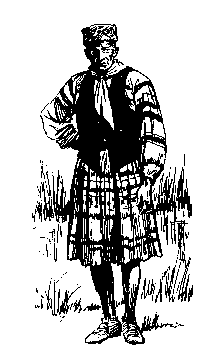
This screenshot has height=349, width=217. In order to click on floor in this screenshot , I will do `click(158, 322)`.